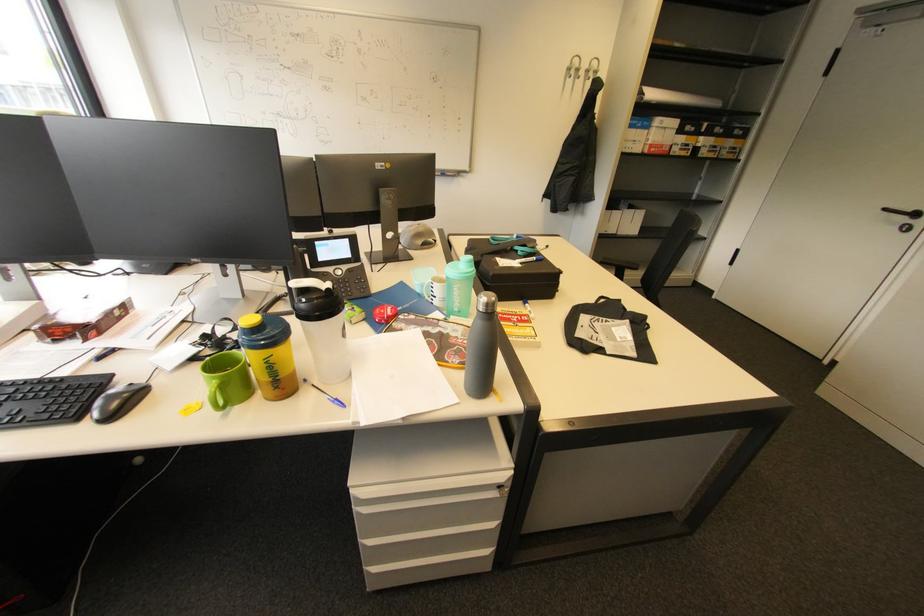
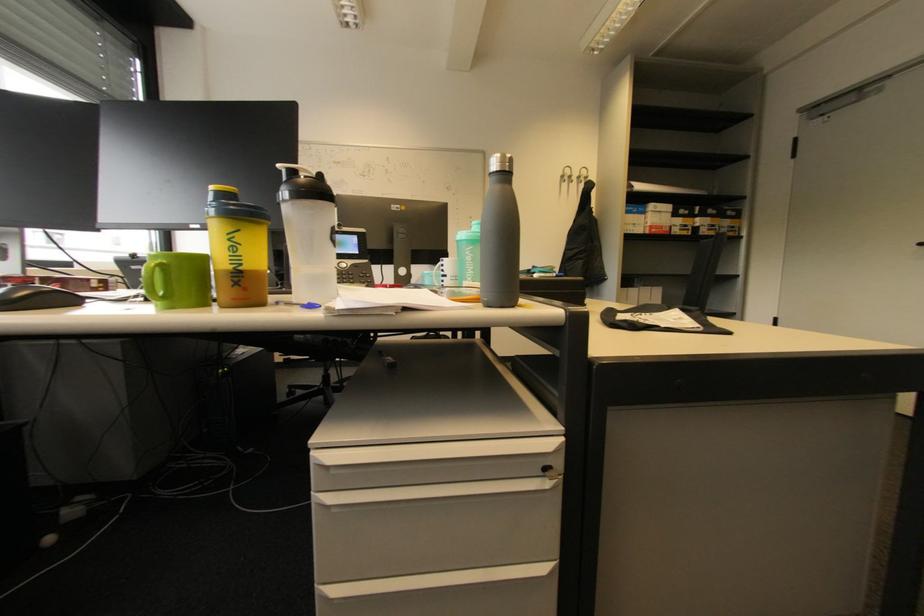
Locate, in the second image, the point that corresponds to pixel 592 71 in the first image.

(584, 177)